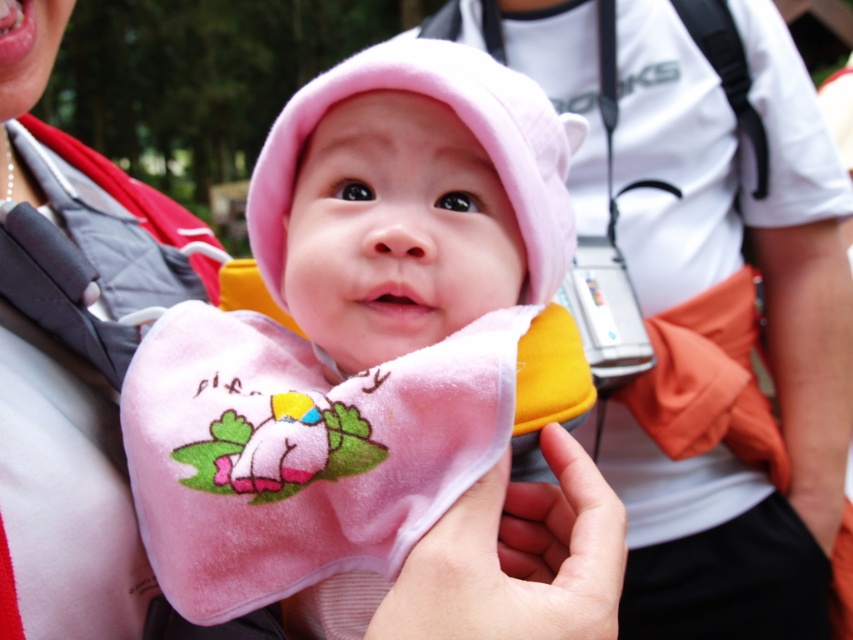
You are a photographer taking a picture of the baby in the pink hooded garment. You notice two points in the image at coordinates point (436, 177) and point (106, 545). Which of these points is closer to the camera?

Point (436, 177) is closer to the camera than point (106, 545).

You are a photographer taking a close up shot of the baby. The pink soft fabric baby at center and the velvet pink bib at center are both in focus. Which object is closer to your camera lens?

The pink soft fabric baby at center is closer to the camera lens because it is further to the viewer than the velvet pink bib at center.